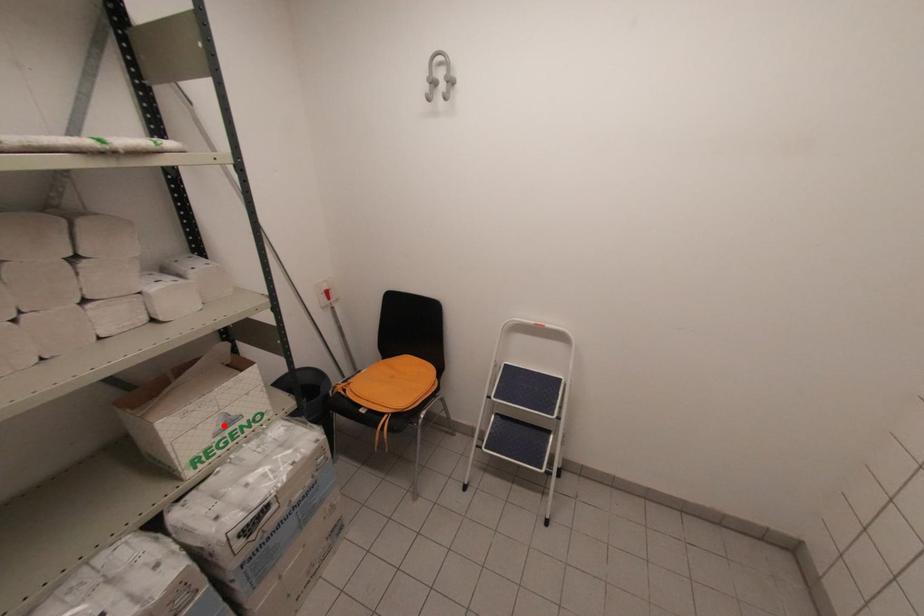
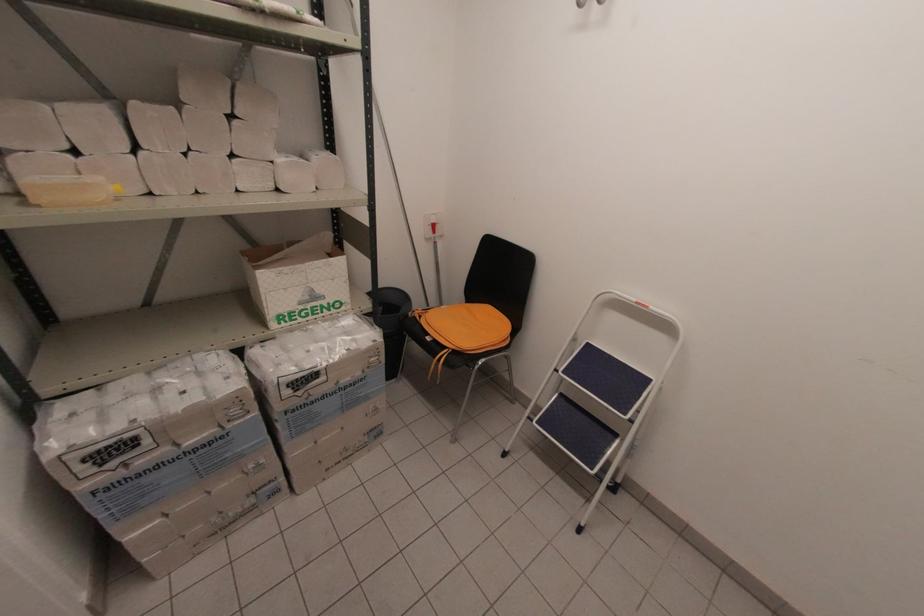
Find the pixel in the second image that matches the highlighted location in the first image.

(309, 298)